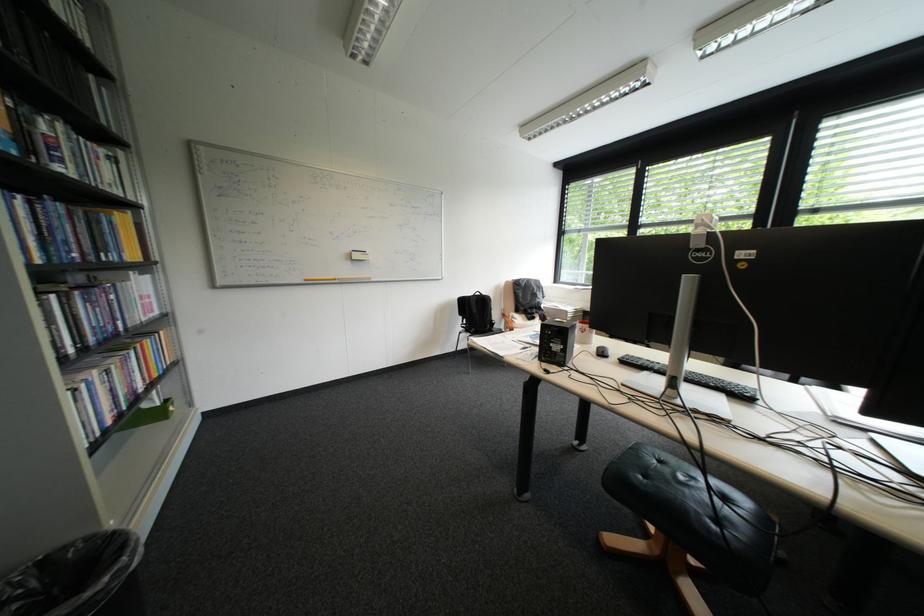
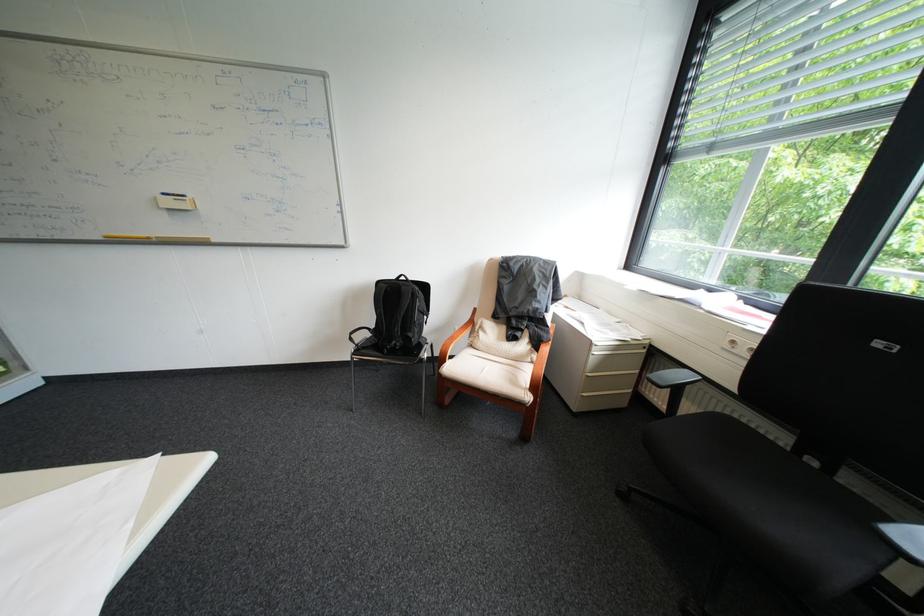
Locate, in the second image, the point that corresponds to (581,315) in the first image.

(609, 353)